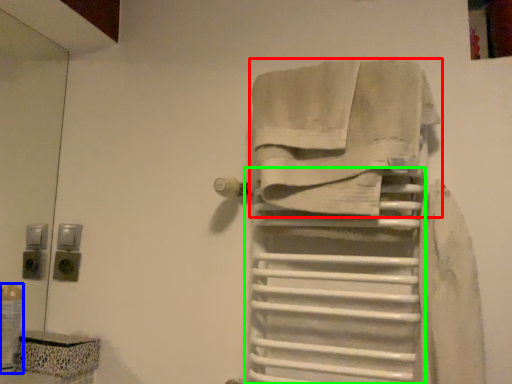
Question: Estimate the real-world distances between objects in this image. Which object is farther from towel (highlighted by a red box), toiletry (highlighted by a blue box) or shelf (highlighted by a green box)?

Choices:
 (A) toiletry
 (B) shelf

Answer: (A)